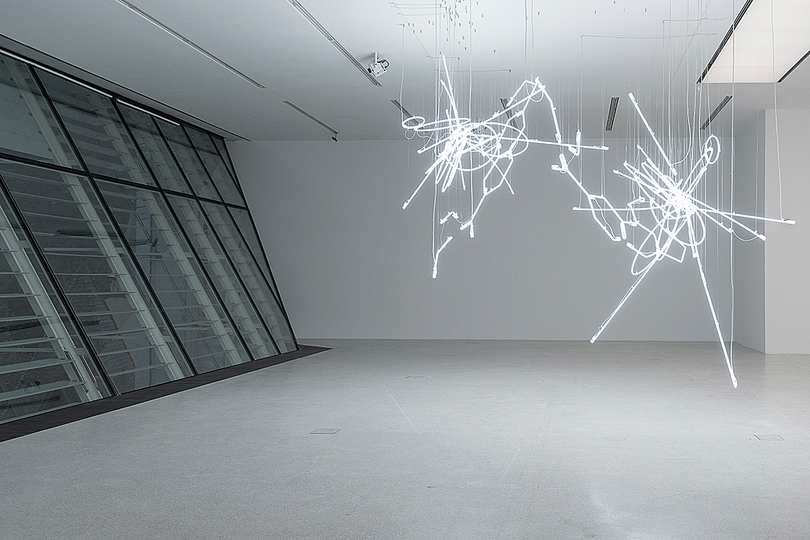
What are the coordinates of `flourescent lights` in the screenshot? It's located at (241, 77), (335, 45), (317, 120), (397, 103), (502, 103), (610, 114), (723, 109), (753, 47).